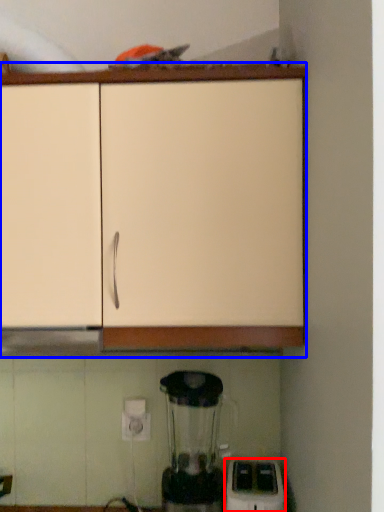
Question: Among these objects, which one is farthest to the camera, home appliance (highlighted by a red box) or cabinetry (highlighted by a blue box)?

Choices:
 (A) home appliance
 (B) cabinetry

Answer: (A)